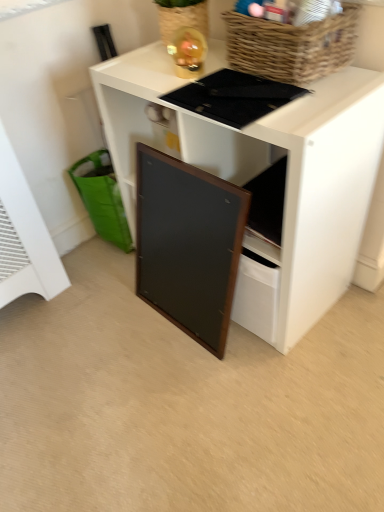
The width and height of the screenshot is (384, 512). In order to click on free space in front of black matte board at center in this screenshot , I will do (235, 409).